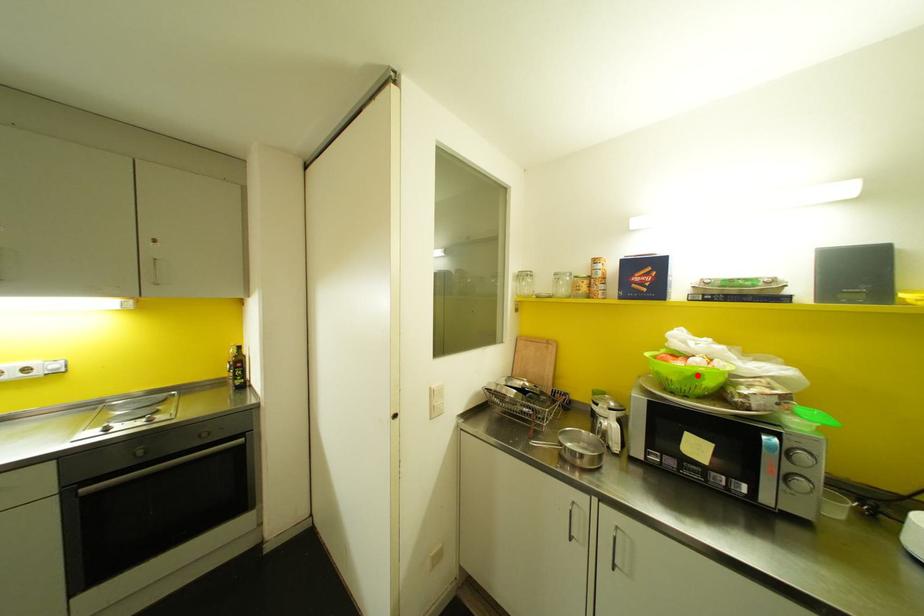
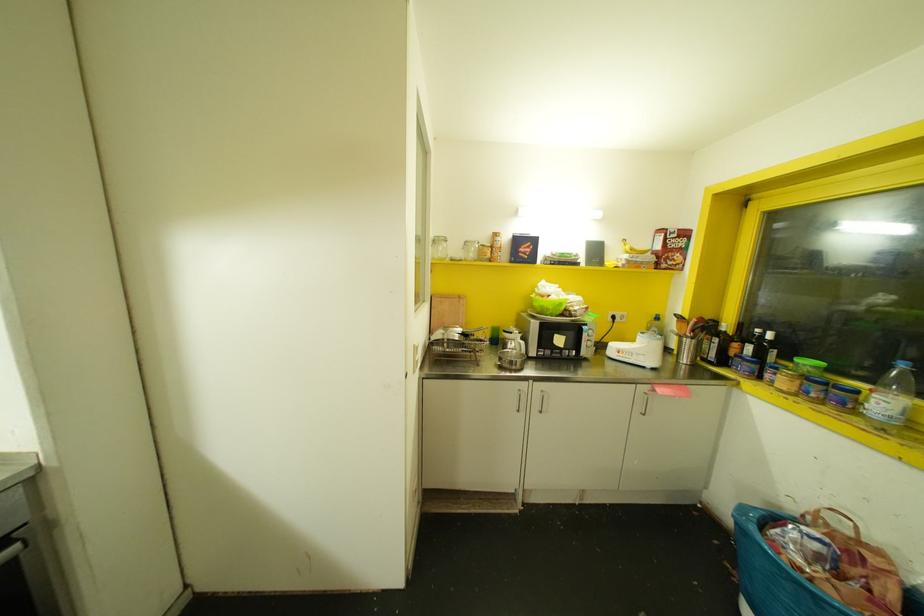
Question: I am providing you with two images of the same scene from different viewpoints. A red point is marked on the first image. Is the red point's position out of view in image 2?

Choices:
 (A) Yes
 (B) No

Answer: (B)